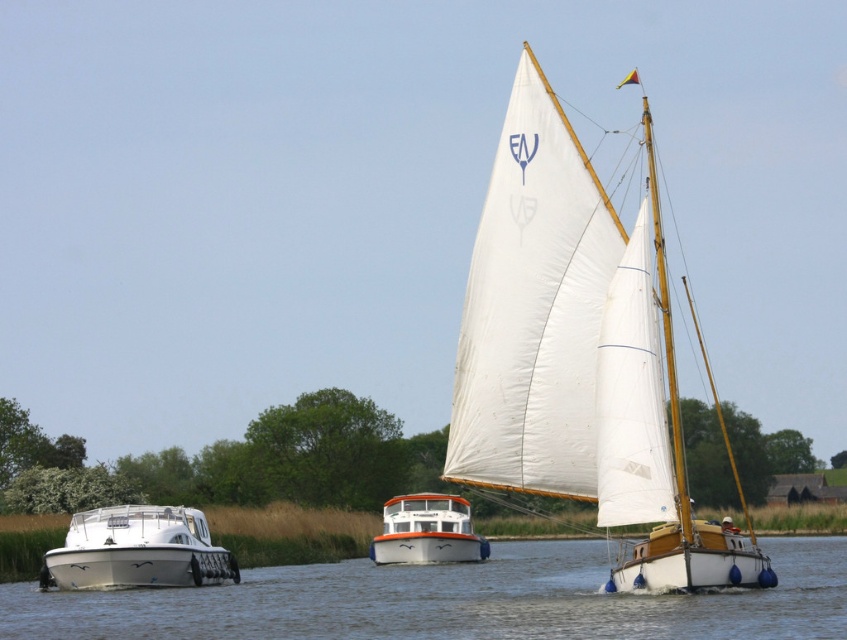
You are a photographer planning to capture the white canvas sailboat at center and the white glossy motorboat at lower left in a single frame. Based on their sizes, which vessel should you focus on to ensure both are visible without cropping? Please explain your reasoning.

The white canvas sailboat at center is taller than the white glossy motorboat at lower left. To ensure both are visible without cropping, focus on the white canvas sailboat at center since it is the taller one and requires more vertical space in the frame.